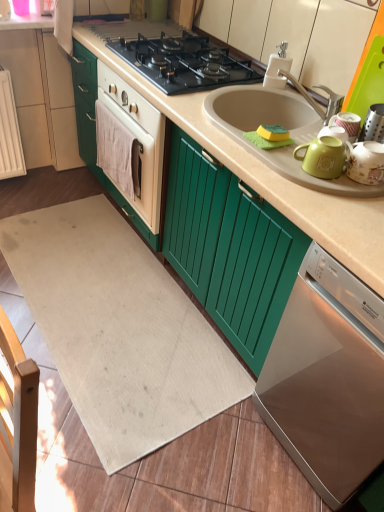
Question: Can you confirm if matte green tea pot at right is positioned to the left of white plastic faucet at upper right?

Choices:
 (A) yes
 (B) no

Answer: (B)

Question: Is white plastic faucet at upper right surrounded by matte green tea pot at right?

Choices:
 (A) yes
 (B) no

Answer: (B)

Question: From a real-world perspective, is matte green tea pot at right physically below white plastic faucet at upper right?

Choices:
 (A) yes
 (B) no

Answer: (A)

Question: Is the depth of matte green tea pot at right greater than that of white plastic faucet at upper right?

Choices:
 (A) yes
 (B) no

Answer: (B)

Question: From the image's perspective, is matte green tea pot at right above white plastic faucet at upper right?

Choices:
 (A) yes
 (B) no

Answer: (B)

Question: Considering the positions of satin silver dishwasher at lower right and black matte gas stove at center in the image, is satin silver dishwasher at lower right bigger or smaller than black matte gas stove at center?

Choices:
 (A) big
 (B) small

Answer: (A)

Question: Is satin silver dishwasher at lower right taller or shorter than black matte gas stove at center?

Choices:
 (A) short
 (B) tall

Answer: (B)

Question: Is satin silver dishwasher at lower right to the left or to the right of black matte gas stove at center in the image?

Choices:
 (A) right
 (B) left

Answer: (A)

Question: Would you say satin silver dishwasher at lower right is inside or outside black matte gas stove at center?

Choices:
 (A) inside
 (B) outside

Answer: (B)

Question: Is matte green tea pot at right inside the boundaries of satin silver dishwasher at lower right, or outside?

Choices:
 (A) inside
 (B) outside

Answer: (B)

Question: Based on their sizes in the image, would you say matte green tea pot at right is bigger or smaller than satin silver dishwasher at lower right?

Choices:
 (A) small
 (B) big

Answer: (A)

Question: Is matte green tea pot at right wider or thinner than satin silver dishwasher at lower right?

Choices:
 (A) wide
 (B) thin

Answer: (B)

Question: In terms of height, does matte green tea pot at right look taller or shorter compared to satin silver dishwasher at lower right?

Choices:
 (A) short
 (B) tall

Answer: (A)

Question: Considering the positions of satin silver dishwasher at lower right and white plastic faucet at upper right in the image, is satin silver dishwasher at lower right bigger or smaller than white plastic faucet at upper right?

Choices:
 (A) small
 (B) big

Answer: (B)

Question: Would you say satin silver dishwasher at lower right is inside or outside white plastic faucet at upper right?

Choices:
 (A) outside
 (B) inside

Answer: (A)